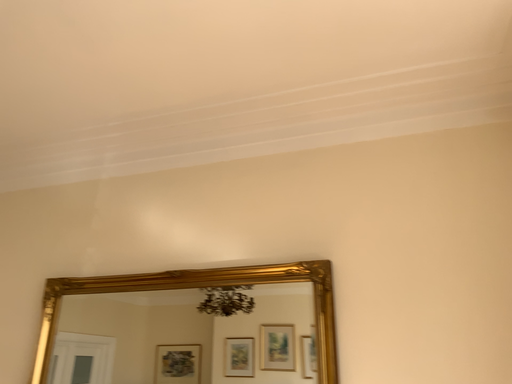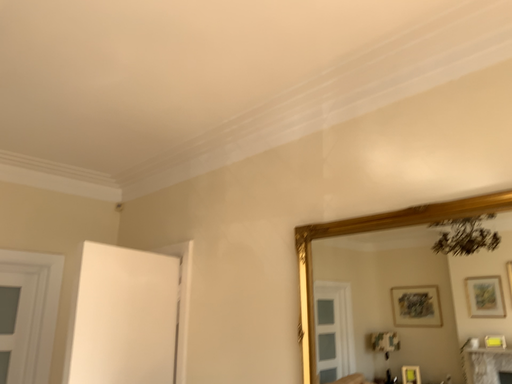
Question: How did the camera likely rotate when shooting the video?

Choices:
 (A) rotated downward
 (B) rotated upward

Answer: (A)